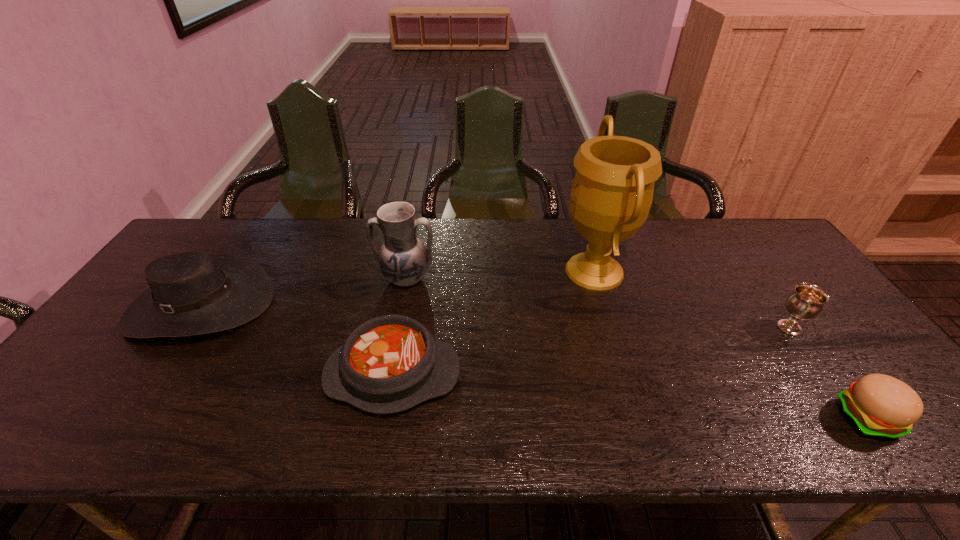
You are a GUI agent. You are given a task and a screenshot of the screen. Output one action in this format:
    pyautogui.click(x=<x>, y=<y>)
    Task: Click on the free space located on the engravings side of the trophy
    
    Given the screenshot: What is the action you would take?
    pyautogui.click(x=460, y=271)

Where is `vacant space positioned on the front-facing side of the fifth shortest object`? vacant space positioned on the front-facing side of the fifth shortest object is located at coordinates click(386, 381).

The image size is (960, 540). Find the location of `vacant space located on the front-facing side of the leftmost object`. vacant space located on the front-facing side of the leftmost object is located at coordinates (113, 435).

Where is `free space located on the front of the chalice`? This screenshot has height=540, width=960. free space located on the front of the chalice is located at coordinates (831, 387).

Find the location of a particular element. vacant region located 0.260m on the left of the casserole is located at coordinates (217, 375).

Locate an element on the screen. The width and height of the screenshot is (960, 540). vacant region located on the back of the hamburger is located at coordinates (777, 294).

Where is `object at the far edge`? object at the far edge is located at coordinates (611, 195).

The height and width of the screenshot is (540, 960). I want to click on casserole that is at the near edge, so click(391, 363).

Find the location of a particular element. Image resolution: width=960 pixels, height=540 pixels. hamburger situated at the near edge is located at coordinates (881, 406).

The image size is (960, 540). Find the location of `object present at the left edge`. object present at the left edge is located at coordinates (192, 293).